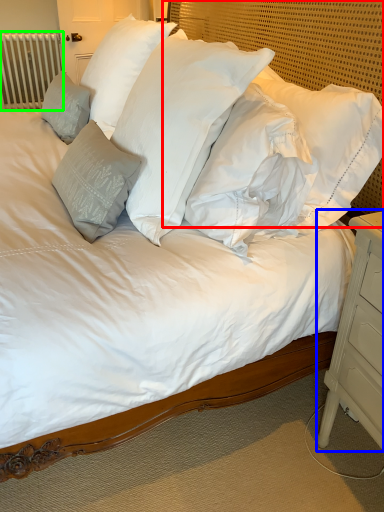
Question: Which is farther away from headboard (highlighted by a red box)? nightstand (highlighted by a blue box) or radiator (highlighted by a green box)?

Choices:
 (A) nightstand
 (B) radiator

Answer: (B)